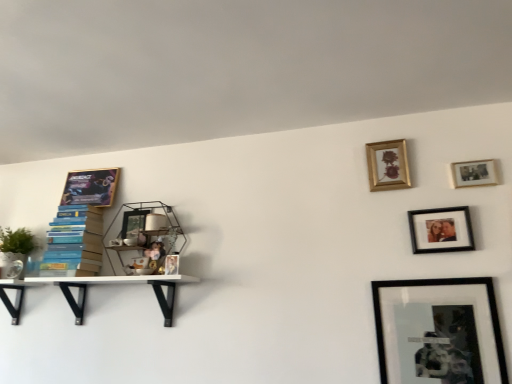
Question: Is matte black picture frame at upper right, positioned as the fifth picture frame in left-to-right order, outside metallic wire shelf at upper center, which is the first shelf from right to left?

Choices:
 (A) no
 (B) yes

Answer: (B)

Question: From a real-world perspective, is matte black picture frame at upper right, which is counted as the 2th picture frame, starting from the front, on top of metallic wire shelf at upper center, which is the first shelf from right to left?

Choices:
 (A) yes
 (B) no

Answer: (B)

Question: Would you consider matte black picture frame at upper right, which is counted as the 2th picture frame, starting from the front, to be distant from metallic wire shelf at upper center, which is the first shelf from right to left?

Choices:
 (A) yes
 (B) no

Answer: (A)

Question: Is matte black picture frame at upper right, positioned as the fifth picture frame in left-to-right order, to the left of metallic wire shelf at upper center, which is the first shelf from right to left, from the viewer's perspective?

Choices:
 (A) no
 (B) yes

Answer: (A)

Question: From a real-world perspective, is matte black picture frame at upper right, positioned as the 5th picture frame in back-to-front order, located beneath metallic wire shelf at upper center, which is the first shelf from right to left?

Choices:
 (A) no
 (B) yes

Answer: (B)

Question: In terms of width, does metallic wire shelf at upper center, the third shelf when ordered from left to right, look wider or thinner when compared to black matte picture frame at lower right, the 1th picture frame positioned from the front?

Choices:
 (A) thin
 (B) wide

Answer: (B)

Question: Is point (164, 240) closer or farther from the camera than point (380, 337)?

Choices:
 (A) farther
 (B) closer

Answer: (A)

Question: Considering the positions of metallic wire shelf at upper center, which is the first shelf from right to left, and black matte picture frame at lower right, which ranks as the fourth picture frame in left-to-right order, in the image, is metallic wire shelf at upper center, which is the first shelf from right to left, taller or shorter than black matte picture frame at lower right, which ranks as the fourth picture frame in left-to-right order,?

Choices:
 (A) tall
 (B) short

Answer: (B)

Question: Based on their positions, is metallic wire shelf at upper center, the third shelf when ordered from left to right, located to the left or right of black matte picture frame at lower right, the 1th picture frame positioned from the front?

Choices:
 (A) right
 (B) left

Answer: (B)

Question: Is metallic wire shelf at upper center, which is the first shelf from right to left, bigger or smaller than white matte shelf at left, the 2th shelf positioned from the right?

Choices:
 (A) small
 (B) big

Answer: (A)

Question: In the image, is metallic wire shelf at upper center, the third shelf when ordered from left to right, positioned in front of or behind white matte shelf at left, the 2th shelf viewed from the left?

Choices:
 (A) front
 (B) behind

Answer: (B)

Question: In terms of width, does metallic wire shelf at upper center, which is the first shelf from right to left, look wider or thinner when compared to white matte shelf at left, the 2th shelf viewed from the left?

Choices:
 (A) wide
 (B) thin

Answer: (B)

Question: Is point (x=109, y=258) positioned closer to the camera than point (x=74, y=307)?

Choices:
 (A) farther
 (B) closer

Answer: (A)

Question: Is point click(x=489, y=162) closer or farther from the camera than point click(x=141, y=230)?

Choices:
 (A) farther
 (B) closer

Answer: (B)

Question: Looking at their shapes, would you say wooden photo frame at upper right, acting as the 6th picture frame starting from the left, is wider or thinner than metallic wire shelf at upper center, the third shelf when ordered from left to right?

Choices:
 (A) wide
 (B) thin

Answer: (B)